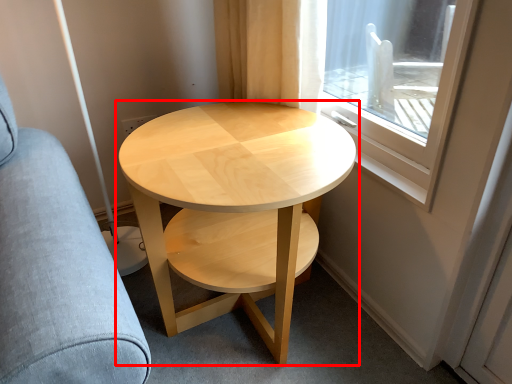
Question: Considering the relative positions of coffee table (annotated by the red box) and swivel chair in the image provided, where is coffee table (annotated by the red box) located with respect to the staircase?

Choices:
 (A) right
 (B) left

Answer: (A)